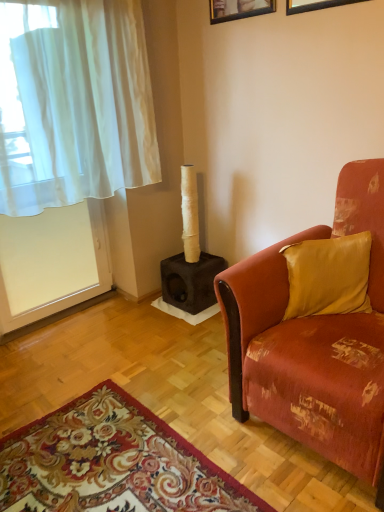
Locate an element on the screen. The height and width of the screenshot is (512, 384). free location to the left of velvet orange couch at right is located at coordinates (188, 392).